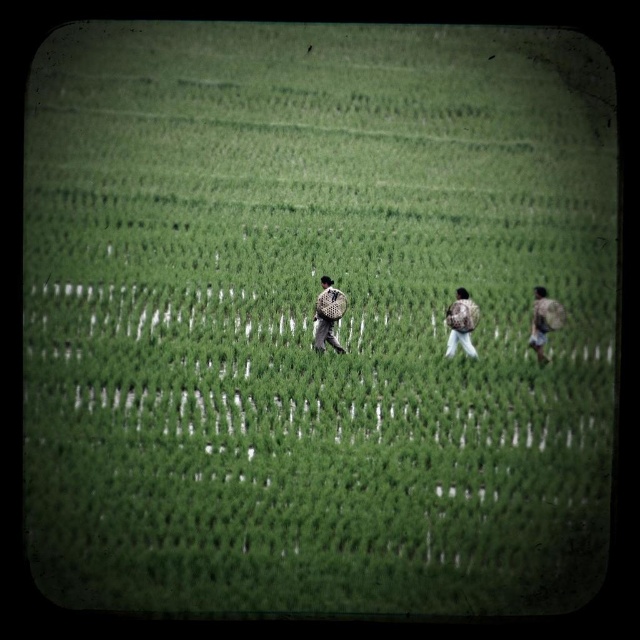
You are standing in the rice paddy field and want to reach a specific point marked at coordinates point [342,307]. Given that your current position is 100 feet away from this point, how much closer do you need to move to reach it?

The point [342,307] is 83.17 feet from the viewer. Since you are currently 100 feet away, you need to move 16.83 feet closer to reach it.